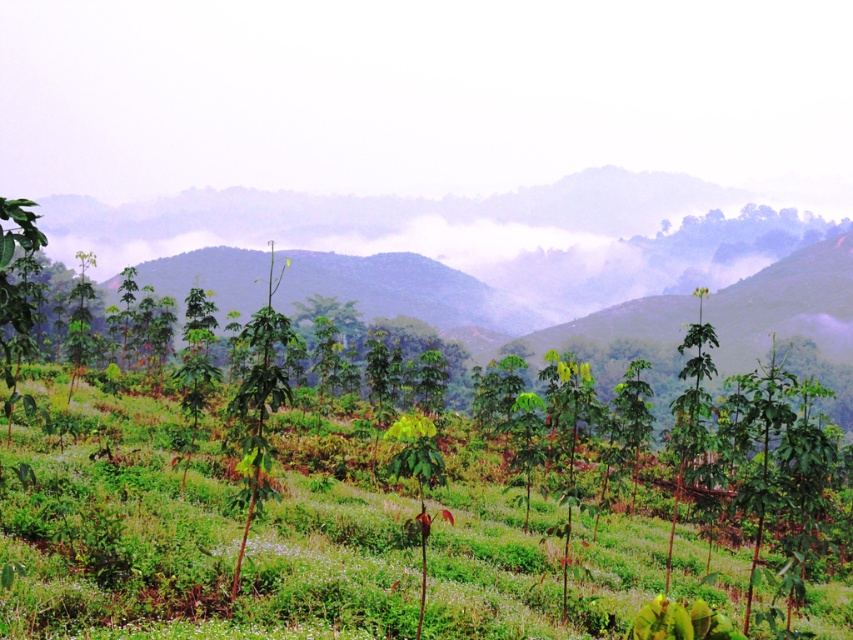
Question: Is green leafy grass at center to the right of green leafy tree at center from the viewer's perspective?

Choices:
 (A) no
 (B) yes

Answer: (B)

Question: Does green leafy grass at center appear over green leafy tree at center?

Choices:
 (A) no
 (B) yes

Answer: (A)

Question: Does green leafy grass at center have a greater width compared to green leafy tree at center?

Choices:
 (A) no
 (B) yes

Answer: (A)

Question: Which object appears farthest from the camera in this image?

Choices:
 (A) green leafy grass at center
 (B) green leafy tree at center

Answer: (B)